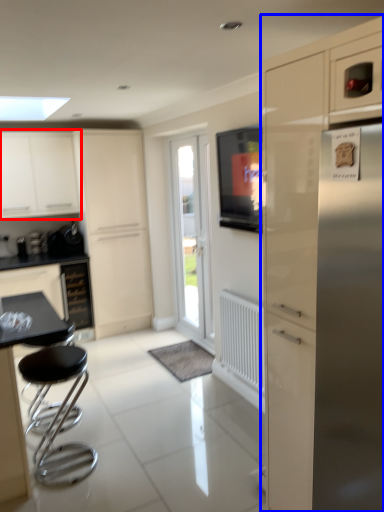
Question: Which object is closer to the camera taking this photo, cabinetry (highlighted by a red box) or cabinetry (highlighted by a blue box)?

Choices:
 (A) cabinetry
 (B) cabinetry

Answer: (B)